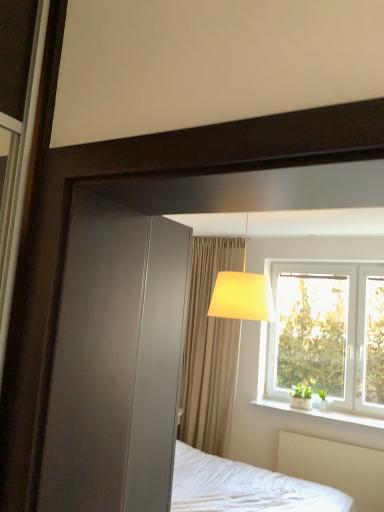
Question: In the image, is white ceramic window sill at lower right on the left side or the right side of matte yellow fabric lampshade at upper center?

Choices:
 (A) left
 (B) right

Answer: (B)

Question: Based on their sizes in the image, would you say white ceramic window sill at lower right is bigger or smaller than matte yellow fabric lampshade at upper center?

Choices:
 (A) small
 (B) big

Answer: (A)

Question: Considering the real-world distances, which object is closest to the beige fabric curtain at center?

Choices:
 (A) white plastic window at upper right
 (B) white ceramic window sill at lower right
 (C) matte yellow fabric lampshade at upper center
 (D) white textured radiator at lower right

Answer: (A)

Question: Which is nearer to the white ceramic window sill at lower right?

Choices:
 (A) beige fabric curtain at center
 (B) matte yellow fabric lampshade at upper center
 (C) white plastic window at upper right
 (D) white textured radiator at lower right

Answer: (D)